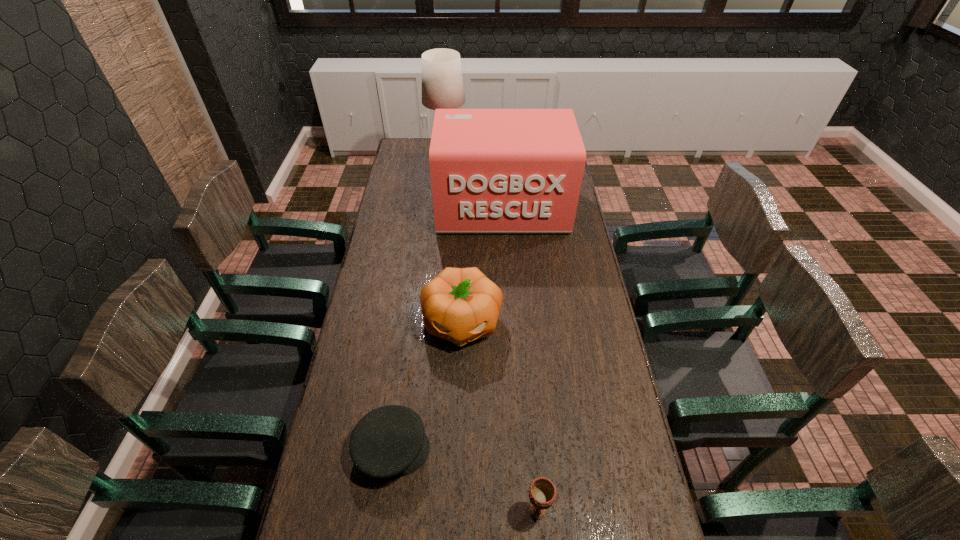
This screenshot has height=540, width=960. I want to click on vacant region at the left edge of the desktop, so click(x=393, y=352).

Locate an element on the screen. The height and width of the screenshot is (540, 960). vacant area at the right edge of the desktop is located at coordinates (622, 392).

Image resolution: width=960 pixels, height=540 pixels. What are the coordinates of `vacant space at the far left corner` in the screenshot? It's located at (399, 160).

Image resolution: width=960 pixels, height=540 pixels. What are the coordinates of `free space between the pumpkin and the shortest object` in the screenshot? It's located at (427, 386).

Find the location of a particular element. The height and width of the screenshot is (540, 960). free spot between the pumpkin and the farthest object is located at coordinates (454, 239).

Identify the location of vacant area that lies between the third tallest object and the chalice. Image resolution: width=960 pixels, height=540 pixels. (500, 416).

Image resolution: width=960 pixels, height=540 pixels. Find the location of `free space between the third tallest object and the fourth farthest object`. free space between the third tallest object and the fourth farthest object is located at coordinates (427, 386).

This screenshot has width=960, height=540. Identify the location of vacant region between the third shortest object and the beret. (427, 386).

I want to click on free area in between the chalice and the third nearest object, so click(500, 416).

You are a GUI agent. You are given a task and a screenshot of the screen. Output one action in this format:
    pyautogui.click(x=<x>, y=<y>)
    Task: Click on the free space between the third farthest object and the nearest object
    This screenshot has width=960, height=540.
    Given the screenshot: What is the action you would take?
    click(x=500, y=416)